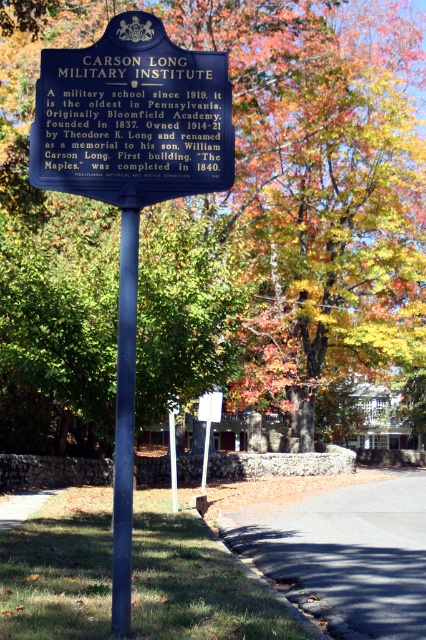
You are a visitor at the Carson Long Military Institute historical marker. You see a green leafy tree at center and a blue metallic pole at center. Which object is closer to the viewer?

The green leafy tree at center is positioned over the blue metallic pole at center, meaning it is closer to the viewer.

You are a tourist standing in front of the blue metal sign at center and the blue metallic pole at center. Which object is closer to you?

The blue metal sign at center is closer to you because the blue metallic pole at center is behind it.

You are standing in front of the historical marker sign and notice a green leafy tree at center and a blue metal sign at center. Which object is taller?

The green leafy tree at center is taller than the blue metal sign at center.